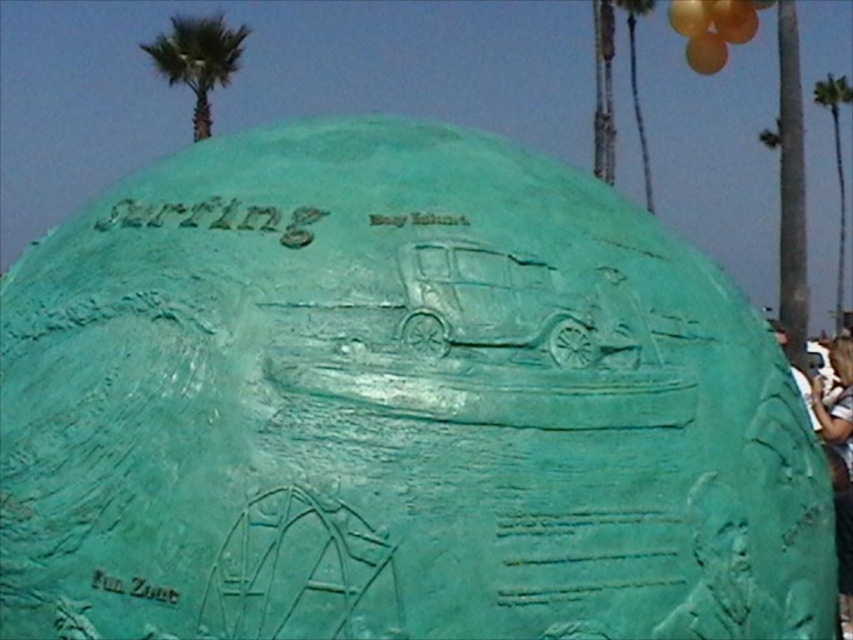
In the scene shown: You are standing in front of the teal dome with the word Surfing and Boy Island. You see a white fabric person at right and a green patina palm tree at upper right. Which object is casting a shadow on the other?

The green patina palm tree at upper right is casting a shadow on the white fabric person at right because the person is positioned under the palm tree.

You are standing in front of the dome structure and want to know how far the point at coordinates (x=830, y=397) is from you. Can you determine the distance?

The point at coordinates (x=830, y=397) is 13.27 meters away from the camera, so the distance is 13.27 meters.

In the scene shown: You are standing in front of the teal dome structure and see the white fabric person at right and the green patina palm tree at upper right. Which object is closer to you?

The white fabric person at right is closer to you because it is in front of the green patina palm tree at upper right.